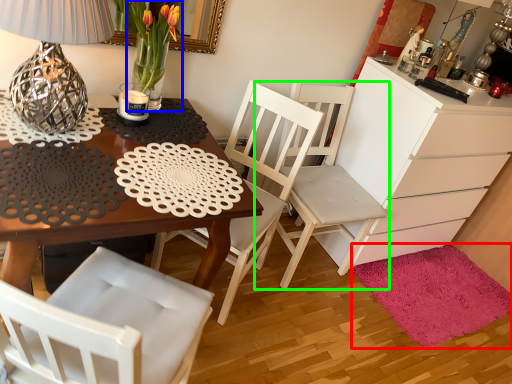
Question: Based on their relative distances, which object is nearer to mat (highlighted by a red box)? Choose from floral arrangement (highlighted by a blue box) and chair (highlighted by a green box).

Choices:
 (A) floral arrangement
 (B) chair

Answer: (B)